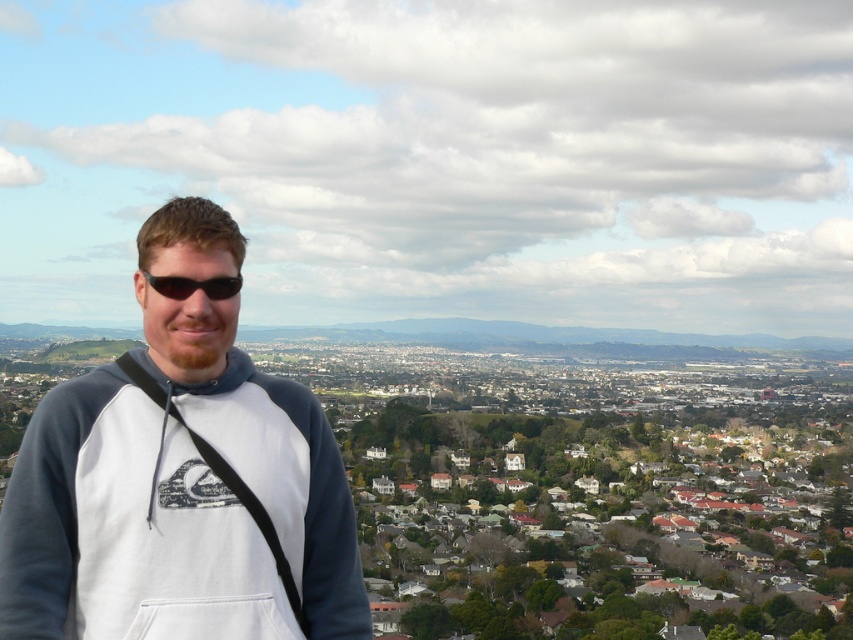
Question: Which of the following is the closest to the observer?

Choices:
 (A) (178, 259)
 (B) (173, 291)

Answer: (B)

Question: Can you confirm if white fleece sweatshirt at center is wider than black matte sunglasses at center?

Choices:
 (A) no
 (B) yes

Answer: (B)

Question: Does white fleece sweatshirt at center have a lesser width compared to black matte sunglasses at center?

Choices:
 (A) no
 (B) yes

Answer: (A)

Question: From the image, what is the correct spatial relationship of white fleece sweatshirt at center in relation to black matte sunglasses at center?

Choices:
 (A) left
 (B) right

Answer: (A)